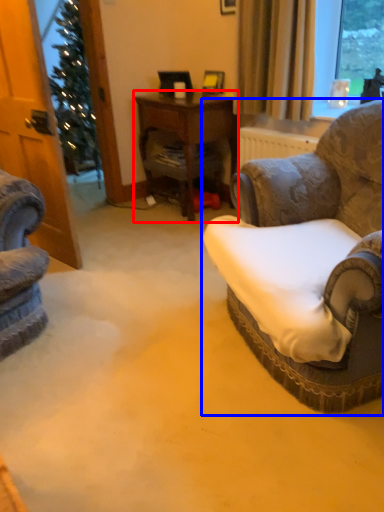
Question: Among these objects, which one is nearest to the camera, desk (highlighted by a red box) or chair (highlighted by a blue box)?

Choices:
 (A) desk
 (B) chair

Answer: (B)